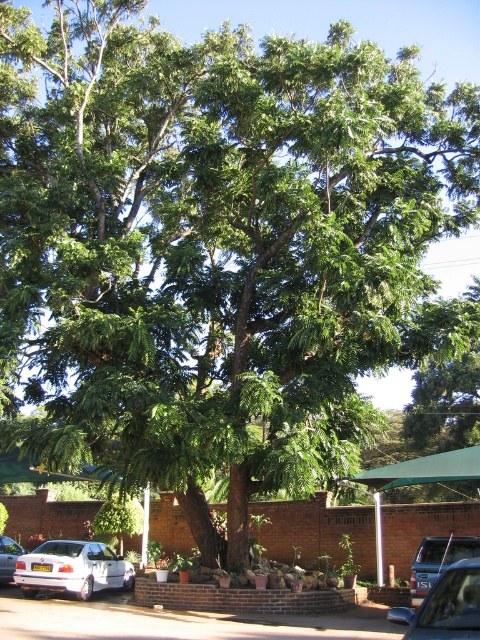
You are a parking attendant and need to guide a driver to park their new vehicle. The driver wants to park their car to the left of the white matte sedan at lower left. Is there enough space between the white matte car at lower left and the brick wall in the background to accommodate a car of similar size?

The white matte sedan at lower left is positioned on the right side of the white matte car at lower left, so there is space between them. However, since both vehicles are at the lower left and the brick wall is in the background, the available space between the white matte car at lower left and the wall may be limited. It is recommended to check the exact dimensions before proceeding.

You are a pedestrian standing at the edge of the road and see the white matte sedan at lower left and the metallic gray suv at center. Which vehicle is closer to you?

The white matte sedan at lower left is closer to you since it is positioned further to the viewer than the metallic gray suv at center, meaning it appears nearer in the visual perspective.